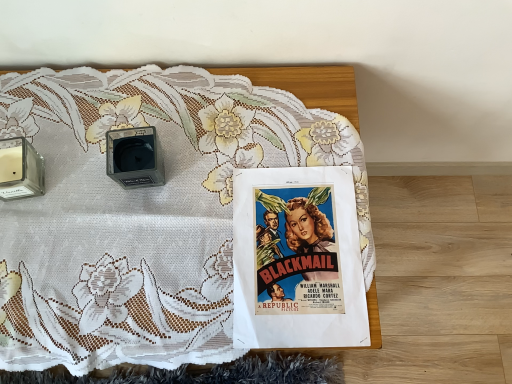
Question: From the image's perspective, does white lace tablecloth at upper center appear lower than matte paper poster at center?

Choices:
 (A) yes
 (B) no

Answer: (B)

Question: Is the depth of white lace tablecloth at upper center less than that of matte paper poster at center?

Choices:
 (A) no
 (B) yes

Answer: (B)

Question: Considering the relative sizes of white lace tablecloth at upper center and matte paper poster at center in the image provided, is white lace tablecloth at upper center taller than matte paper poster at center?

Choices:
 (A) yes
 (B) no

Answer: (A)

Question: Is there a large distance between white lace tablecloth at upper center and matte paper poster at center?

Choices:
 (A) no
 (B) yes

Answer: (A)

Question: Can we say white lace tablecloth at upper center lies outside matte paper poster at center?

Choices:
 (A) no
 (B) yes

Answer: (B)

Question: From a real-world perspective, is white lace tablecloth at upper center under matte paper poster at center?

Choices:
 (A) yes
 (B) no

Answer: (A)

Question: Is transparent glass candle at left, acting as the first speaker starting from the left, closer to camera compared to white lace tablecloth at upper center?

Choices:
 (A) yes
 (B) no

Answer: (B)

Question: Can you confirm if transparent glass candle at left, positioned as the 2th speaker in right-to-left order, is positioned to the right of white lace tablecloth at upper center?

Choices:
 (A) no
 (B) yes

Answer: (A)

Question: Is transparent glass candle at left, acting as the first speaker starting from the left, at the left side of white lace tablecloth at upper center?

Choices:
 (A) yes
 (B) no

Answer: (A)

Question: Can you confirm if transparent glass candle at left, positioned as the 2th speaker in right-to-left order, is wider than white lace tablecloth at upper center?

Choices:
 (A) yes
 (B) no

Answer: (B)

Question: Is transparent glass candle at left, acting as the first speaker starting from the left, positioned behind white lace tablecloth at upper center?

Choices:
 (A) no
 (B) yes

Answer: (B)

Question: Is transparent glass candle at left, positioned as the 2th speaker in right-to-left order, far away from white lace tablecloth at upper center?

Choices:
 (A) no
 (B) yes

Answer: (A)

Question: Is transparent glass candle at left, positioned as the 2th speaker in right-to-left order, to the right of matte paper poster at center from the viewer's perspective?

Choices:
 (A) yes
 (B) no

Answer: (B)